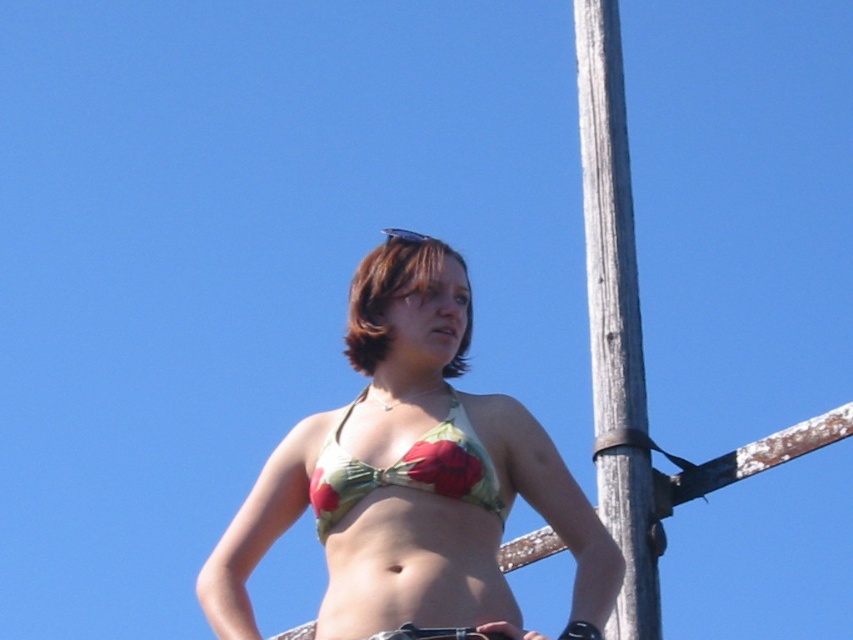
You are a photographer setting up a shot of the person in the scene. Considering the green floral bikini top at center and the brown matte hair at center, which object is taller when viewed from the front?

The green floral bikini top at center is taller than the brown matte hair at center.

You are a photographer trying to capture a closeup shot of the green floral bikini top at center and the brown matte hair at center. Given that your camera can focus on objects within a 5 meter range, will you be able to get a clear shot of both subjects simultaneously?

The distance between the green floral bikini top at center and the brown matte hair at center is 5.65 meters, which exceeds the camera focus range of 5 meters. Therefore, you cannot capture both subjects clearly in the same shot.

You are a photographer taking a portrait of the person in the scene. You want to ensure both the floral fabric bikini top at center and the brown matte hair at center are clearly visible. Based on their positions, which object should you focus on first to ensure both are in frame?

Since the floral fabric bikini top at center is to the right of the brown matte hair at center, you should focus on the brown matte hair at center first to ensure both are in frame.